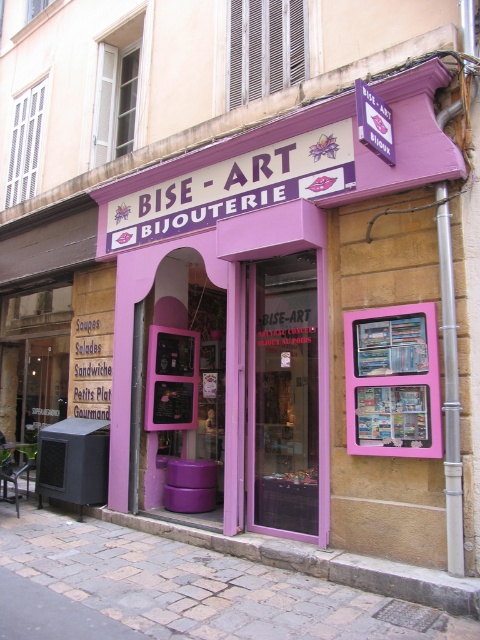
Question: Is paved stone pavement at lower center to the right of pink glossy bulletin board at center from the viewer's perspective?

Choices:
 (A) yes
 (B) no

Answer: (B)

Question: Which point appears farthest from the camera in this image?

Choices:
 (A) (36, 545)
 (B) (387, 336)

Answer: (A)

Question: Can you confirm if paved stone pavement at lower center is positioned above pink glossy bulletin board at center?

Choices:
 (A) no
 (B) yes

Answer: (A)

Question: Does paved stone pavement at lower center come in front of pink glossy bulletin board at center?

Choices:
 (A) no
 (B) yes

Answer: (B)